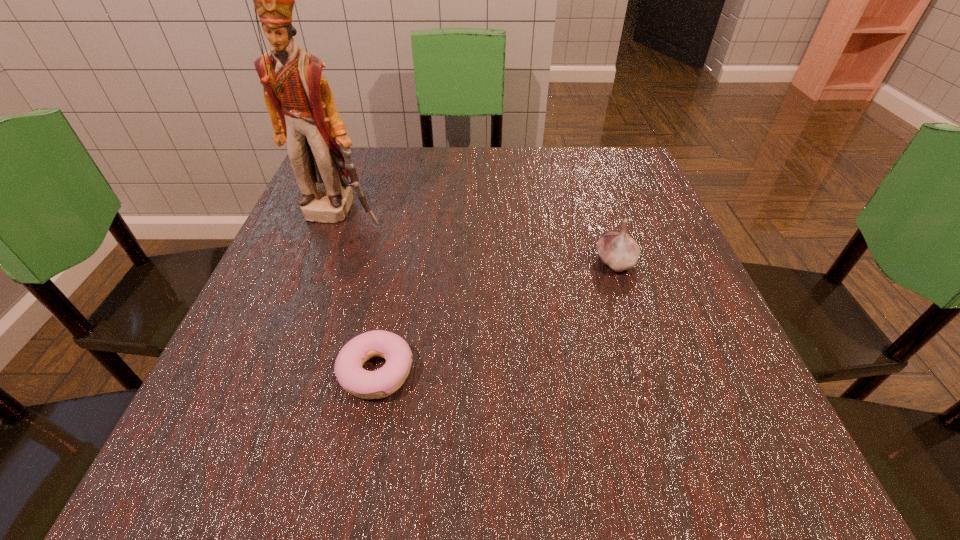
Where is `free space between the rightmost object and the tallest object`? This screenshot has height=540, width=960. free space between the rightmost object and the tallest object is located at coordinates (478, 238).

Find the location of a particular element. This screenshot has height=540, width=960. vacant space that is in between the second nearest object and the doughnut is located at coordinates (496, 317).

This screenshot has height=540, width=960. Find the location of `vacant space that's between the rightmost object and the shortest object`. vacant space that's between the rightmost object and the shortest object is located at coordinates (496, 317).

This screenshot has height=540, width=960. Find the location of `unoccupied area between the farthest object and the shortest object`. unoccupied area between the farthest object and the shortest object is located at coordinates (358, 293).

In order to click on free space between the shortest object and the rightmost object in this screenshot , I will do `click(496, 317)`.

Locate an element on the screen. Image resolution: width=960 pixels, height=540 pixels. unoccupied position between the farthest object and the second tallest object is located at coordinates (478, 238).

The image size is (960, 540). Find the location of `free space between the farthest object and the nearest object`. free space between the farthest object and the nearest object is located at coordinates (358, 293).

Identify the location of vacant point located between the rightmost object and the nearest object. The image size is (960, 540). (x=496, y=317).

Where is `free space between the tallest object and the shortest object`? The image size is (960, 540). free space between the tallest object and the shortest object is located at coordinates (358, 293).

Locate which object is the closest to the rightmost object. Please provide its 2D coordinates. Your answer should be formatted as a tuple, i.e. [(x, y)], where the tuple contains the x and y coordinates of a point satisfying the conditions above.

[(381, 383)]